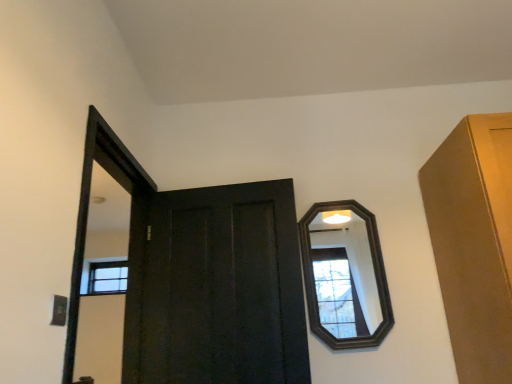
At what (x,y) coordinates should I click in order to perform the action: click on dark wood mirror at upper right. Please return your answer as a coordinate pair (x, y). The height and width of the screenshot is (384, 512). Looking at the image, I should click on (345, 278).

What do you see at coordinates (345, 278) in the screenshot?
I see `dark wood mirror at upper right` at bounding box center [345, 278].

This screenshot has height=384, width=512. Describe the element at coordinates (216, 288) in the screenshot. I see `matte black door at center` at that location.

You are a GUI agent. You are given a task and a screenshot of the screen. Output one action in this format:
    pyautogui.click(x=<x>, y=<y>)
    Task: Click on the matte black door at center
    The width and height of the screenshot is (512, 384).
    Given the screenshot: What is the action you would take?
    pyautogui.click(x=216, y=288)

In order to click on dark wood mirror at upper right in this screenshot , I will do `click(345, 278)`.

Considering the positions of objects dark wood mirror at upper right and matte black door at center in the image provided, who is more to the left, dark wood mirror at upper right or matte black door at center?

From the viewer's perspective, matte black door at center appears more on the left side.

Is dark wood mirror at upper right in front of or behind matte black door at center in the image?

Clearly, dark wood mirror at upper right is behind matte black door at center.

Does point (325, 316) come farther from viewer compared to point (249, 366)?

Yes, point (325, 316) is behind point (249, 366).

From the image's perspective, which is below, dark wood mirror at upper right or matte black door at center?

From the image's view, matte black door at center is below.

From a real-world perspective, which object rests below the other?

From a 3D spatial view, matte black door at center is below.

Considering the relative sizes of dark wood mirror at upper right and matte black door at center in the image provided, is dark wood mirror at upper right thinner than matte black door at center?

Yes.

Which of these two, dark wood mirror at upper right or matte black door at center, stands taller?

Standing taller between the two is matte black door at center.

Who is bigger, dark wood mirror at upper right or matte black door at center?

With larger size is matte black door at center.

Choose the correct answer: Is dark wood mirror at upper right inside matte black door at center or outside it?

dark wood mirror at upper right is not enclosed by matte black door at center.

Is dark wood mirror at upper right not close to matte black door at center?

No.

Is dark wood mirror at upper right oriented away from matte black door at center?

That's not correct — dark wood mirror at upper right is not looking away from matte black door at center.

In the scene shown: What's the angular difference between dark wood mirror at upper right and matte black door at center's facing directions?

6.12 degrees separate the facing orientations of dark wood mirror at upper right and matte black door at center.

Measure the distance from dark wood mirror at upper right to matte black door at center.

46.81 centimeters.

At what (x,y) coordinates should I click in order to perform the action: click on door below the dark wood mirror at upper right (from the image's perspective). Please return your answer as a coordinate pair (x, y). This screenshot has width=512, height=384. Looking at the image, I should click on (216, 288).

In the image, is matte black door at center on the left side or the right side of dark wood mirror at upper right?

In the image, matte black door at center appears on the left side of dark wood mirror at upper right.

Is matte black door at center further to camera compared to dark wood mirror at upper right?

No, it is not.

Does point (137, 349) appear closer or farther from the camera than point (331, 269)?

Point (137, 349) is positioned closer to the camera compared to point (331, 269).

From the image's perspective, is matte black door at center located beneath dark wood mirror at upper right?

Indeed, from the image's perspective, matte black door at center is shown beneath dark wood mirror at upper right.

From a real-world perspective, which is physically above, matte black door at center or dark wood mirror at upper right?

dark wood mirror at upper right.

Between matte black door at center and dark wood mirror at upper right, which one has larger width?

matte black door at center is wider.

Considering the sizes of matte black door at center and dark wood mirror at upper right in the image, is matte black door at center taller or shorter than dark wood mirror at upper right?

matte black door at center is taller than dark wood mirror at upper right.

Who is bigger, matte black door at center or dark wood mirror at upper right?

matte black door at center is bigger.

Can we say matte black door at center lies outside dark wood mirror at upper right?

Absolutely, matte black door at center is external to dark wood mirror at upper right.

Is matte black door at center positioned far away from dark wood mirror at upper right?

No, matte black door at center is not far away from dark wood mirror at upper right.

Is matte black door at center oriented towards dark wood mirror at upper right?

No, matte black door at center is not aimed at dark wood mirror at upper right.

Identify the location of mirror lying on the right of matte black door at center. Image resolution: width=512 pixels, height=384 pixels. (345, 278).

Identify the location of mirror to the right of matte black door at center. (345, 278).

What are the coordinates of `door on the left of the dark wood mirror at upper right` in the screenshot? It's located at (216, 288).